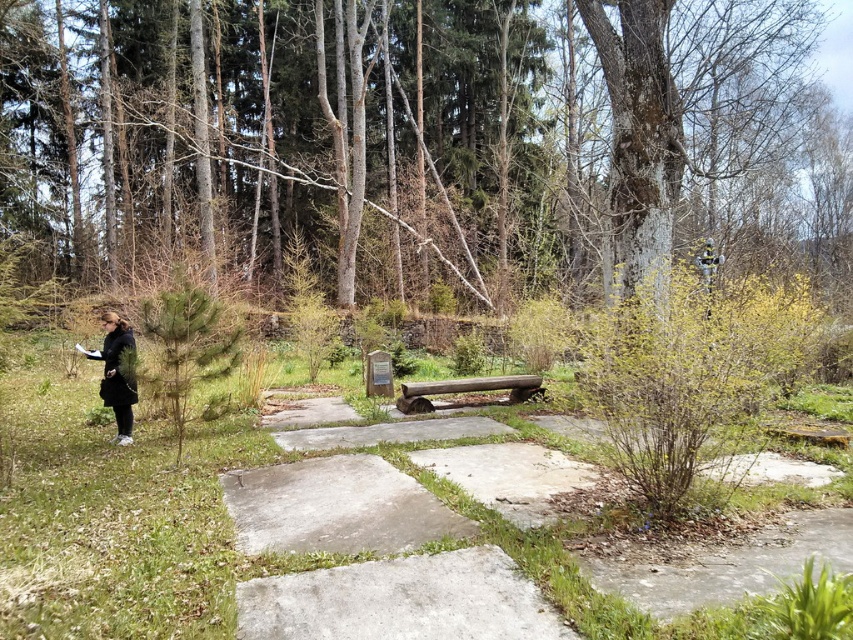
Question: Considering the relative positions of brown bark tree at upper center and black fabric jacket at left in the image provided, where is brown bark tree at upper center located with respect to black fabric jacket at left?

Choices:
 (A) above
 (B) below

Answer: (A)

Question: Does brown bark tree at upper center lie in front of smooth concrete path at center?

Choices:
 (A) yes
 (B) no

Answer: (B)

Question: Which of the following is the closest to the observer?

Choices:
 (A) smooth wooden bench at center
 (B) black fabric jacket at left
 (C) smooth concrete path at center

Answer: (C)

Question: Which point is farther to the camera?

Choices:
 (A) black fabric jacket at left
 (B) brown bark tree at upper center
 (C) smooth concrete path at center

Answer: (B)

Question: Which of the following is the farthest from the observer?

Choices:
 (A) smooth wooden bench at center
 (B) brown bark tree at upper center
 (C) black fabric jacket at left

Answer: (A)

Question: Is smooth concrete path at center smaller than black fabric jacket at left?

Choices:
 (A) no
 (B) yes

Answer: (B)